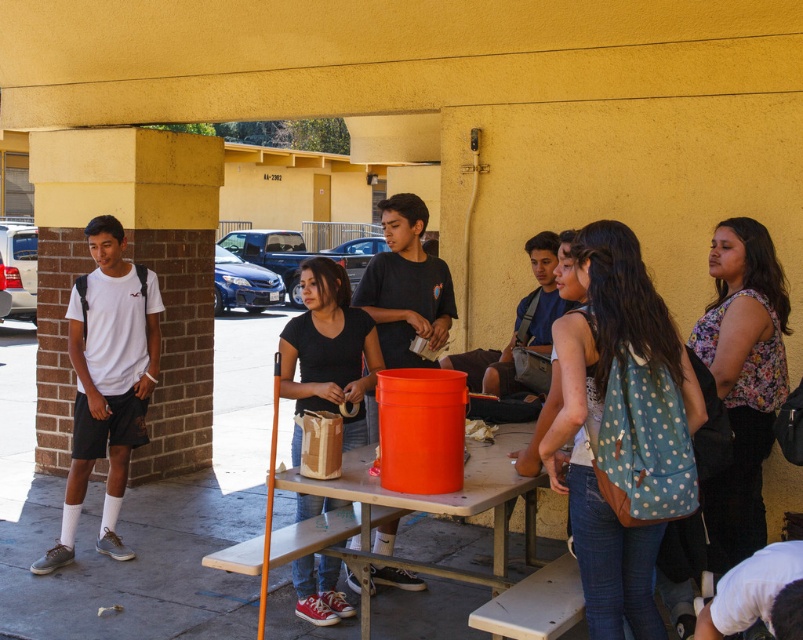
Is matte black shirt at center bigger than matte black backpack at center?

Correct, matte black shirt at center is larger in size than matte black backpack at center.

Who is lower down, matte black shirt at center or matte black backpack at center?

matte black backpack at center is lower down.

Where is `matte black shirt at center`? matte black shirt at center is located at coordinates (406, 285).

Is wooden picnic table at center closer to the viewer compared to matte black shirt at center?

Yes, it is.

Who is higher up, wooden picnic table at center or matte black shirt at center?

matte black shirt at center

This screenshot has height=640, width=803. In order to click on wooden picnic table at center in this screenshot , I will do `click(414, 509)`.

In the scene shown: Which is above, white matte t-shirt at left or matte black backpack at center?

matte black backpack at center is above.

Where is `white matte t-shirt at left`? The width and height of the screenshot is (803, 640). white matte t-shirt at left is located at coordinates (107, 380).

The width and height of the screenshot is (803, 640). I want to click on white matte t-shirt at left, so click(x=107, y=380).